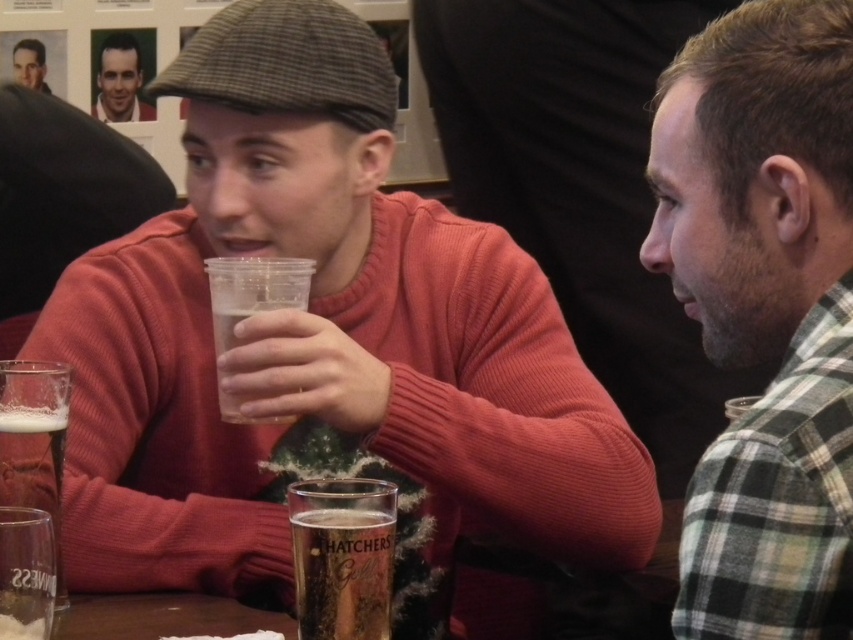
Looking at this image, who is more forward, (334, 624) or (4, 496)?

Positioned in front is point (334, 624).

Based on the photo, between translucent glass at center and clear glass at left, which one is positioned lower?

translucent glass at center is lower down.

This screenshot has height=640, width=853. I want to click on translucent glass at center, so click(341, 556).

The image size is (853, 640). I want to click on translucent glass at center, so click(x=341, y=556).

From the picture: Can you confirm if clear glass at lower left is positioned above matte black sweater at center?

Incorrect, clear glass at lower left is not positioned above matte black sweater at center.

Can you confirm if clear glass at lower left is positioned below matte black sweater at center?

Indeed, clear glass at lower left is positioned under matte black sweater at center.

Who is more distant from viewer, (7,634) or (38,70)?

Point (38,70)

Find the location of `clear glass at lower left`. clear glass at lower left is located at coordinates (25, 573).

Does point (283, 280) come farther from viewer compared to point (115, 90)?

That is False.

Does translucent plastic cup at center have a lesser height compared to smooth skin face at upper left?

No, translucent plastic cup at center is not shorter than smooth skin face at upper left.

The height and width of the screenshot is (640, 853). What do you see at coordinates (252, 291) in the screenshot? I see `translucent plastic cup at center` at bounding box center [252, 291].

The image size is (853, 640). Identify the location of translucent plastic cup at center. (252, 291).